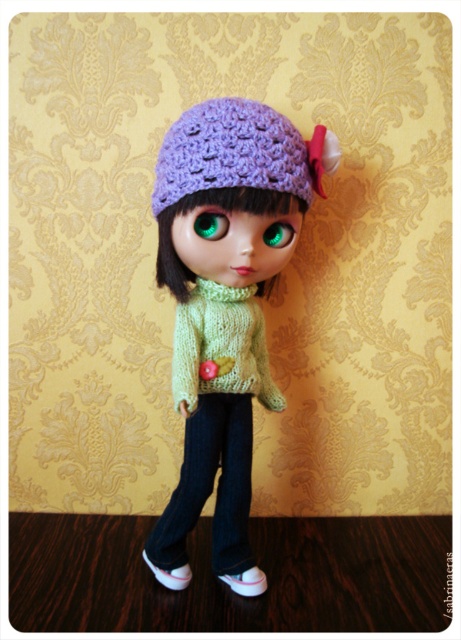
Between green glossy eye at center and green matte eye at center, which one has less height?

Standing shorter between the two is green matte eye at center.

The height and width of the screenshot is (640, 461). What do you see at coordinates (211, 224) in the screenshot?
I see `green glossy eye at center` at bounding box center [211, 224].

Where is `green glossy eye at center`? The height and width of the screenshot is (640, 461). green glossy eye at center is located at coordinates (211, 224).

Does point (202, 221) come closer to viewer compared to point (225, 573)?

Yes, it is.

Identify the location of green glossy eye at center. Image resolution: width=461 pixels, height=640 pixels. (211, 224).

Does knitted green sweater at center have a lesser height compared to white matte shoe at lower left?

No, knitted green sweater at center is not shorter than white matte shoe at lower left.

Does knitted green sweater at center have a lesser width compared to white matte shoe at lower left?

Incorrect, knitted green sweater at center's width is not less than white matte shoe at lower left's.

I want to click on knitted green sweater at center, so click(222, 346).